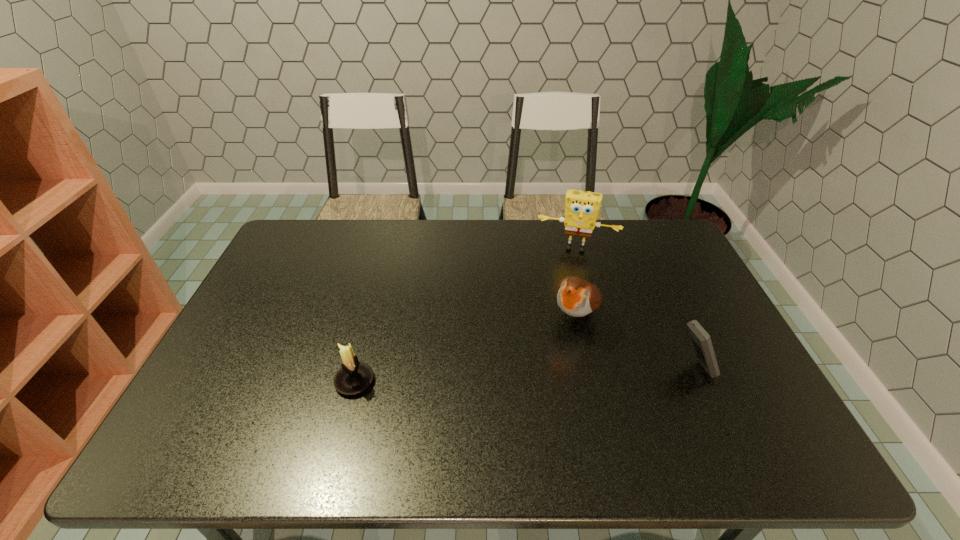
Where is `blank space at the near right corner of the desktop`? This screenshot has height=540, width=960. blank space at the near right corner of the desktop is located at coordinates (707, 406).

Find the location of a particular element. unoccupied area between the leftmost object and the second farthest object is located at coordinates (466, 349).

Image resolution: width=960 pixels, height=540 pixels. Identify the location of free area in between the bird and the candle holder. (466, 349).

Where is `free area in between the farthest object and the candle holder`? free area in between the farthest object and the candle holder is located at coordinates (466, 315).

Locate an element on the screen. This screenshot has height=540, width=960. unoccupied area between the sponge and the leftmost object is located at coordinates (466, 315).

Where is `empty space between the rightmost object and the leftmost object`? The width and height of the screenshot is (960, 540). empty space between the rightmost object and the leftmost object is located at coordinates (524, 375).

The width and height of the screenshot is (960, 540). I want to click on free space between the rightmost object and the sponge, so click(x=636, y=308).

This screenshot has width=960, height=540. What are the coordinates of `vacant region between the sponge and the rightmost object` in the screenshot? It's located at (636, 308).

I want to click on free space between the candle holder and the bird, so click(466, 349).

Identify the location of object that is the second closest one to the rightmost object. The width and height of the screenshot is (960, 540). (582, 208).